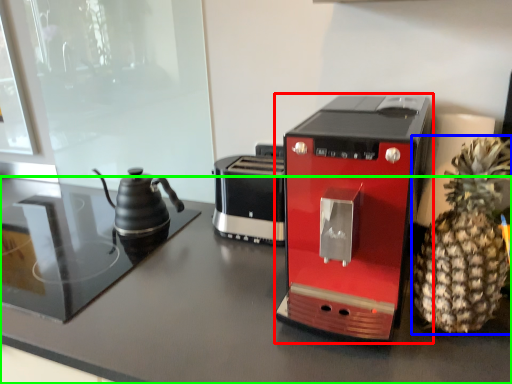
Question: Considering the real-world distances, which object is farthest from coffee maker (highlighted by a red box)? pineapple (highlighted by a blue box) or table (highlighted by a green box)?

Choices:
 (A) pineapple
 (B) table

Answer: (B)